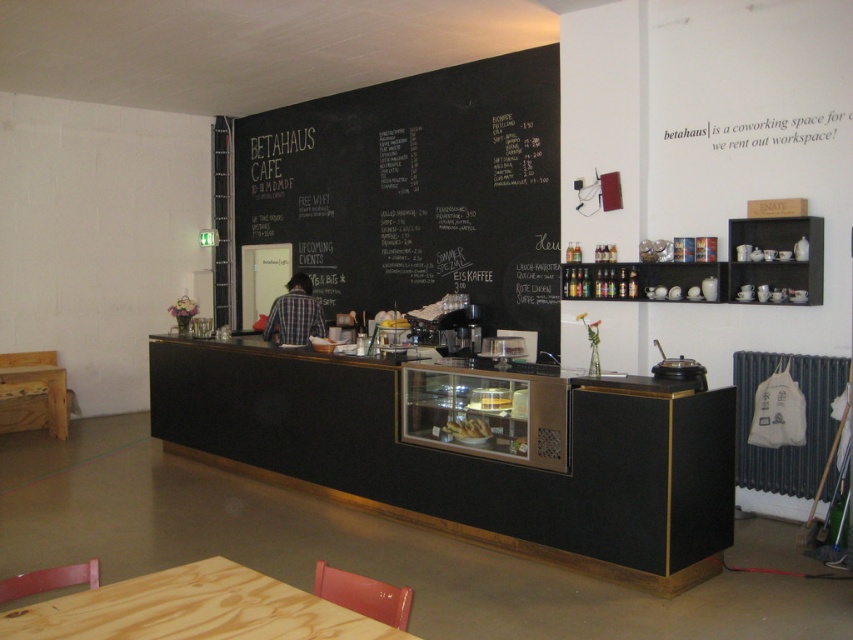
Is pine wood table at lower left further to camera compared to wooden table at lower left?

No, it is in front of wooden table at lower left.

Can you confirm if pine wood table at lower left is positioned above wooden table at lower left?

Incorrect, pine wood table at lower left is not positioned above wooden table at lower left.

What do you see at coordinates (192, 609) in the screenshot? I see `pine wood table at lower left` at bounding box center [192, 609].

The image size is (853, 640). What are the coordinates of `pine wood table at lower left` in the screenshot? It's located at (192, 609).

Is black chalkboard at center smaller than translucent glass cake at center?

No.

Based on the photo, measure the distance from black chalkboard at center to translucent glass cake at center.

black chalkboard at center is 3.18 meters away from translucent glass cake at center.

Identify the location of black chalkboard at center. The height and width of the screenshot is (640, 853). (416, 189).

In order to click on black chalkboard at center in this screenshot , I will do `click(416, 189)`.

Does black chalkboard at center appear on the left side of pine wood table at lower left?

Yes, black chalkboard at center is to the left of pine wood table at lower left.

Is black chalkboard at center shorter than pine wood table at lower left?

Incorrect, black chalkboard at center's height does not fall short of pine wood table at lower left's.

The image size is (853, 640). What are the coordinates of `black chalkboard at center` in the screenshot? It's located at (416, 189).

The image size is (853, 640). I want to click on black chalkboard at center, so click(x=416, y=189).